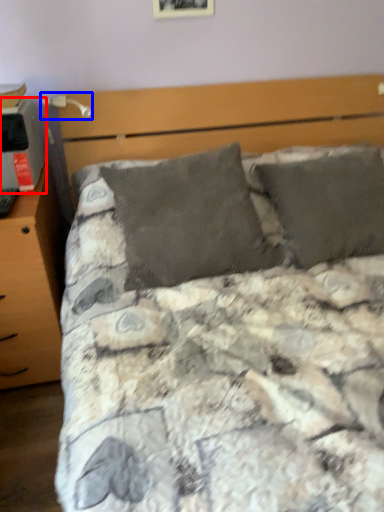
Question: Which object appears closest to the camera in this image, desktop (highlighted by a red box) or table lamp (highlighted by a blue box)?

Choices:
 (A) desktop
 (B) table lamp

Answer: (A)